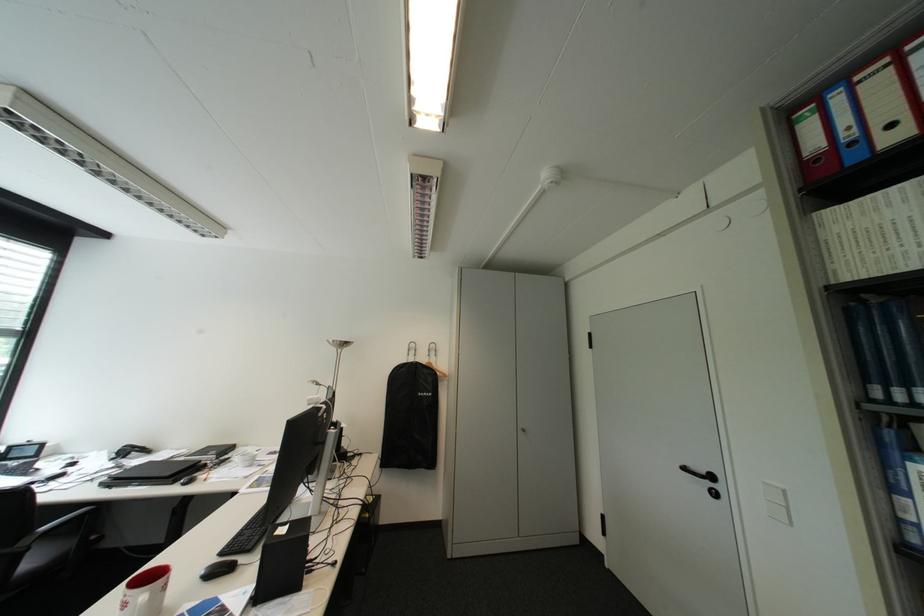
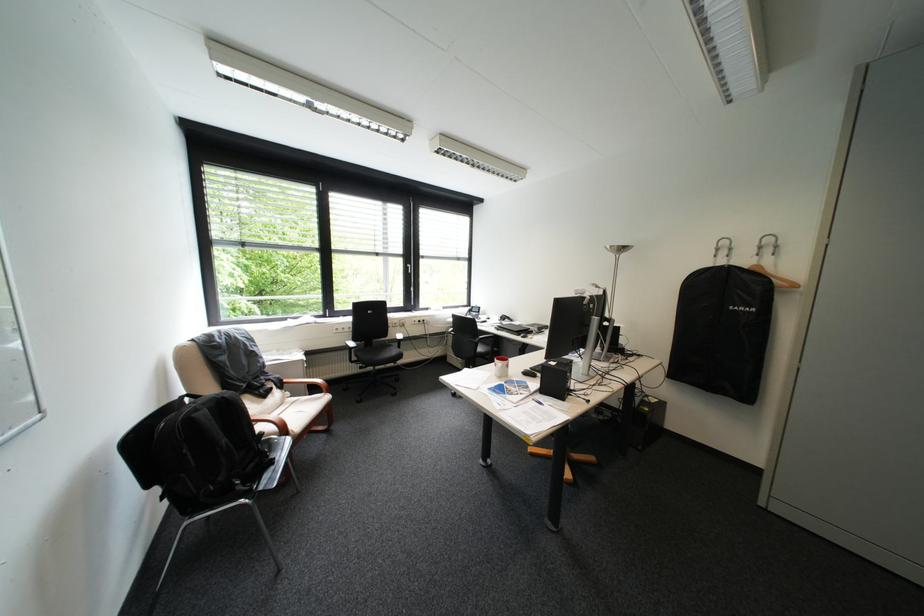
In the second image, find the point that corresponds to point (299, 528) in the first image.

(568, 363)